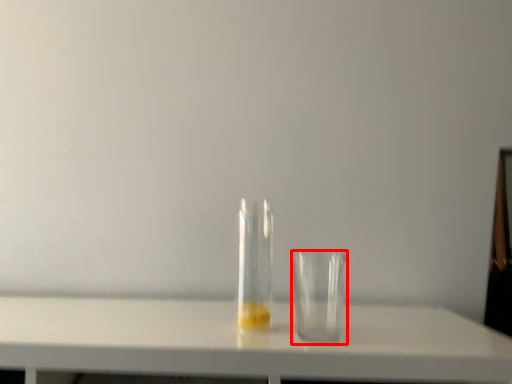
Question: Considering the relative positions of tableware (annotated by the red box) and bottle in the image provided, where is tableware (annotated by the red box) located with respect to the staircase?

Choices:
 (A) right
 (B) left

Answer: (A)